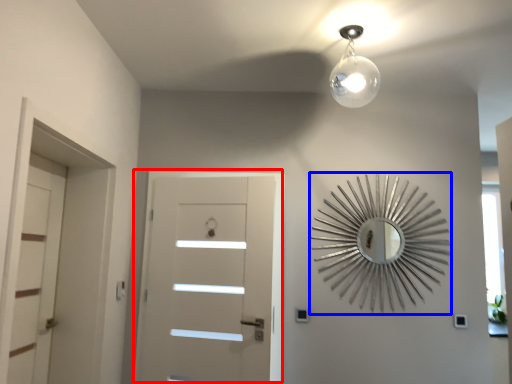
Question: Which point is further to the camera, door (highlighted by a red box) or design (highlighted by a blue box)?

Choices:
 (A) door
 (B) design

Answer: (B)